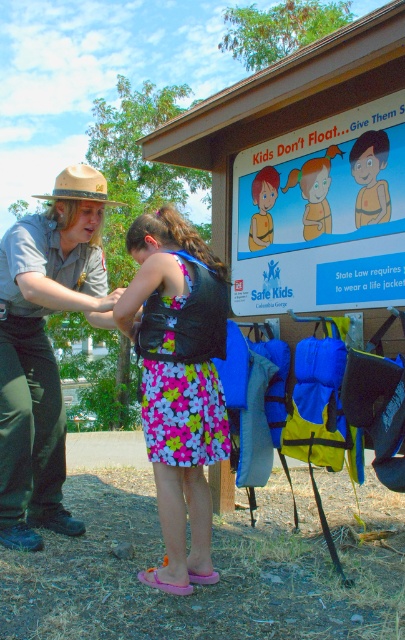
Question: Which of the following is the closest to the observer?

Choices:
 (A) floral fabric dress at center
 (B) matte yellow life jacket at center
 (C) blue plastic sign at upper center
 (D) khaki uniform at center

Answer: (A)

Question: Does blue plastic sign at upper center come behind khaki uniform at center?

Choices:
 (A) no
 (B) yes

Answer: (B)

Question: Is blue plastic sign at upper center above floral fabric dress at center?

Choices:
 (A) yes
 (B) no

Answer: (A)

Question: Which point appears closest to the camera in this image?

Choices:
 (A) (98, 305)
 (B) (326, 166)
 (C) (198, 484)

Answer: (C)

Question: Which point is farther to the camera?

Choices:
 (A) (211, 300)
 (B) (115, 296)
 (C) (48, 259)

Answer: (C)

Question: Can you confirm if floral fabric dress at center is positioned to the right of khaki uniform at center?

Choices:
 (A) no
 (B) yes

Answer: (B)